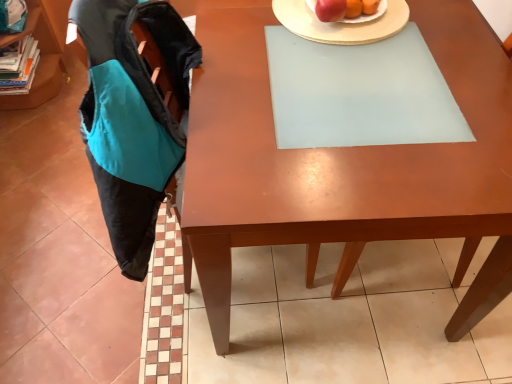
Question: From the image's perspective, is black fabric swivel chair at left below shiny red apple at upper center?

Choices:
 (A) no
 (B) yes

Answer: (B)

Question: Is black fabric swivel chair at left oriented away from shiny red apple at upper center?

Choices:
 (A) no
 (B) yes

Answer: (A)

Question: From a real-world perspective, does black fabric swivel chair at left sit lower than shiny red apple at upper center?

Choices:
 (A) no
 (B) yes

Answer: (B)

Question: Does black fabric swivel chair at left have a greater width compared to shiny red apple at upper center?

Choices:
 (A) yes
 (B) no

Answer: (A)

Question: Considering the relative sizes of black fabric swivel chair at left and shiny red apple at upper center in the image provided, is black fabric swivel chair at left smaller than shiny red apple at upper center?

Choices:
 (A) yes
 (B) no

Answer: (B)

Question: Is point (347, 24) positioned closer to the camera than point (36, 92)?

Choices:
 (A) farther
 (B) closer

Answer: (B)

Question: Is white ceramic plate at upper center in front of or behind teal fabric shelf at upper left in the image?

Choices:
 (A) front
 (B) behind

Answer: (A)

Question: In the image, is white ceramic plate at upper center on the left side or the right side of teal fabric shelf at upper left?

Choices:
 (A) left
 (B) right

Answer: (B)

Question: From the image's perspective, is white ceramic plate at upper center located above or below teal fabric shelf at upper left?

Choices:
 (A) above
 (B) below

Answer: (B)

Question: Considering the relative positions of matte wooden desk at center and teal fabric shelf at upper left in the image provided, is matte wooden desk at center to the left or to the right of teal fabric shelf at upper left?

Choices:
 (A) right
 (B) left

Answer: (A)

Question: From a real-world perspective, is matte wooden desk at center physically located above or below teal fabric shelf at upper left?

Choices:
 (A) above
 (B) below

Answer: (A)

Question: In terms of height, does matte wooden desk at center look taller or shorter compared to teal fabric shelf at upper left?

Choices:
 (A) tall
 (B) short

Answer: (A)

Question: Would you say matte wooden desk at center is inside or outside teal fabric shelf at upper left?

Choices:
 (A) outside
 (B) inside

Answer: (A)

Question: Is teal fabric book at left bigger or smaller than teal fabric shelf at upper left?

Choices:
 (A) big
 (B) small

Answer: (B)

Question: Choose the correct answer: Is teal fabric book at left inside teal fabric shelf at upper left or outside it?

Choices:
 (A) inside
 (B) outside

Answer: (A)